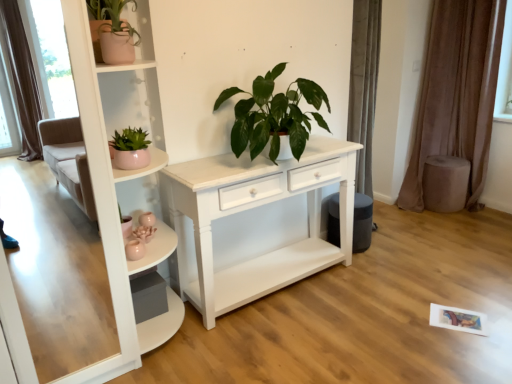
Question: Which is correct: pink ceramic pot at upper left, which ranks as the 3th houseplant in right-to-left order, is inside green glossy plant at center, acting as the third houseplant starting from the left, or outside of it?

Choices:
 (A) outside
 (B) inside

Answer: (A)

Question: Based on their positions, is pink ceramic pot at upper left, the first houseplant positioned from the left, located to the left or right of green glossy plant at center, marked as the first houseplant in a right-to-left arrangement?

Choices:
 (A) left
 (B) right

Answer: (A)

Question: Estimate the real-world distances between objects in this image. Which object is farther from the green glossy plant at center, marked as the first houseplant in a right-to-left arrangement?

Choices:
 (A) matte pink pot at left, the 2th houseplant viewed from the right
 (B) brown velvet curtain at right
 (C) pink ceramic pot at upper left, which ranks as the 3th houseplant in right-to-left order
 (D) white glossy shelf at upper left

Answer: (B)

Question: Considering the real-world distances, which object is farthest from the brown velvet curtain at right?

Choices:
 (A) green glossy plant at center, marked as the first houseplant in a right-to-left arrangement
 (B) white glossy shelf at upper left
 (C) pink ceramic pot at upper left, which ranks as the 3th houseplant in right-to-left order
 (D) matte pink pot at left, which is the 2th houseplant from left to right

Answer: (C)